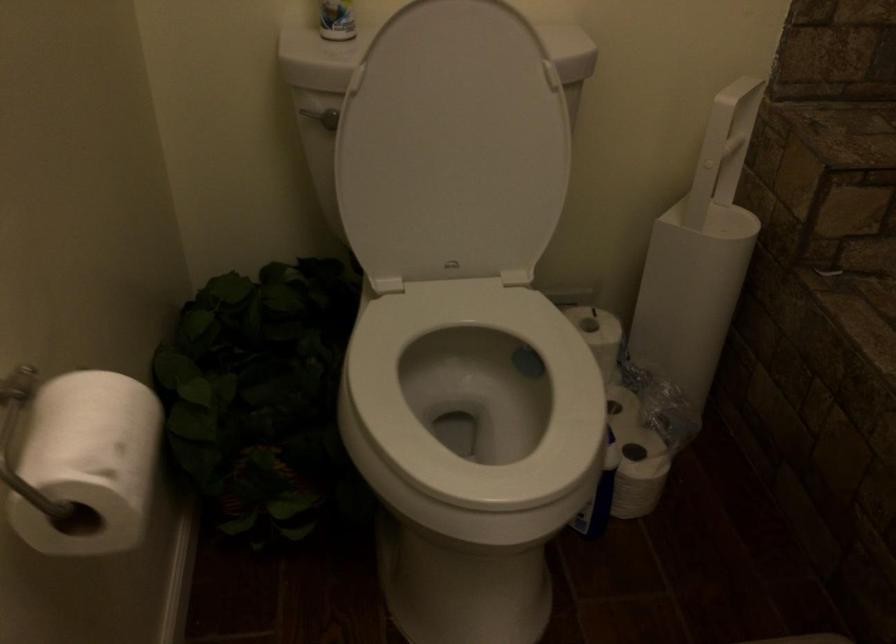
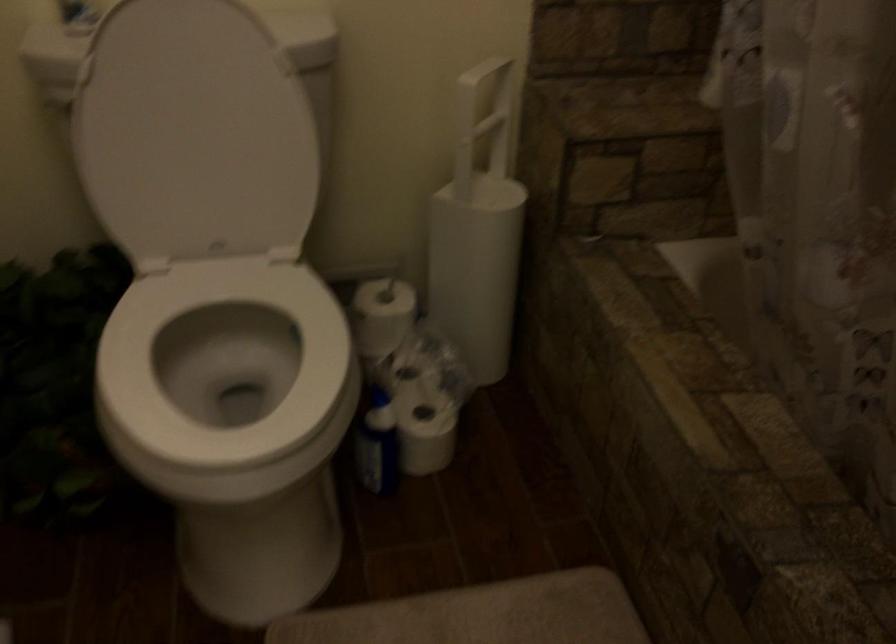
Where in the second image is the point corresponding to (636,476) from the first image?

(426, 436)